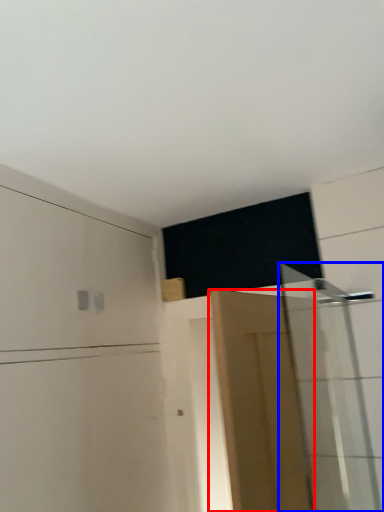
Question: Which object is closer to the camera taking this photo, door (highlighted by a red box) or shower door (highlighted by a blue box)?

Choices:
 (A) door
 (B) shower door

Answer: (A)